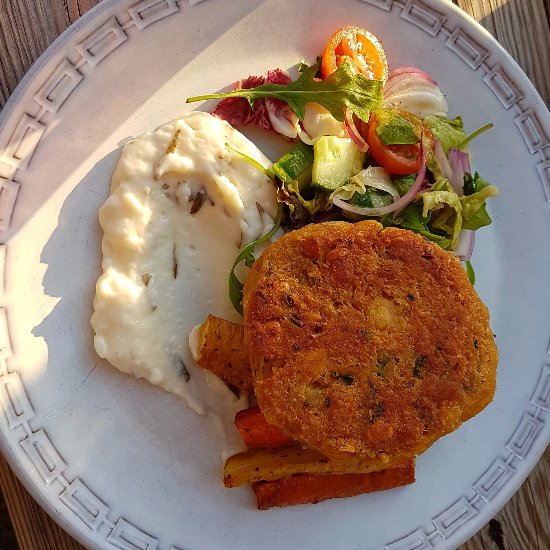
Locate an element on the screen. plate is located at coordinates (522, 246).